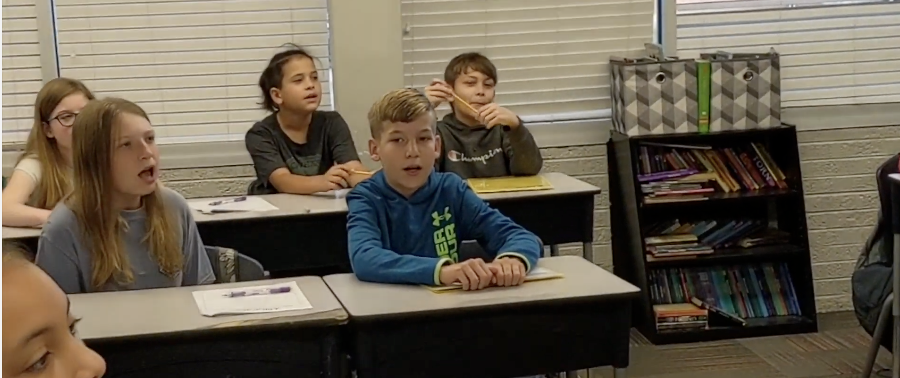
Identify the location of school books on shelves. (718, 170), (681, 234), (736, 296).